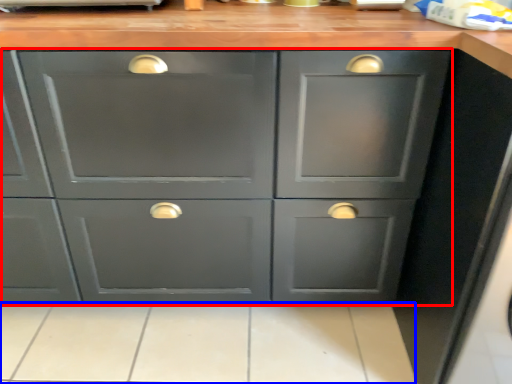
Question: Which point is further to the camera, cabinetry (highlighted by a red box) or tile (highlighted by a blue box)?

Choices:
 (A) cabinetry
 (B) tile

Answer: (B)